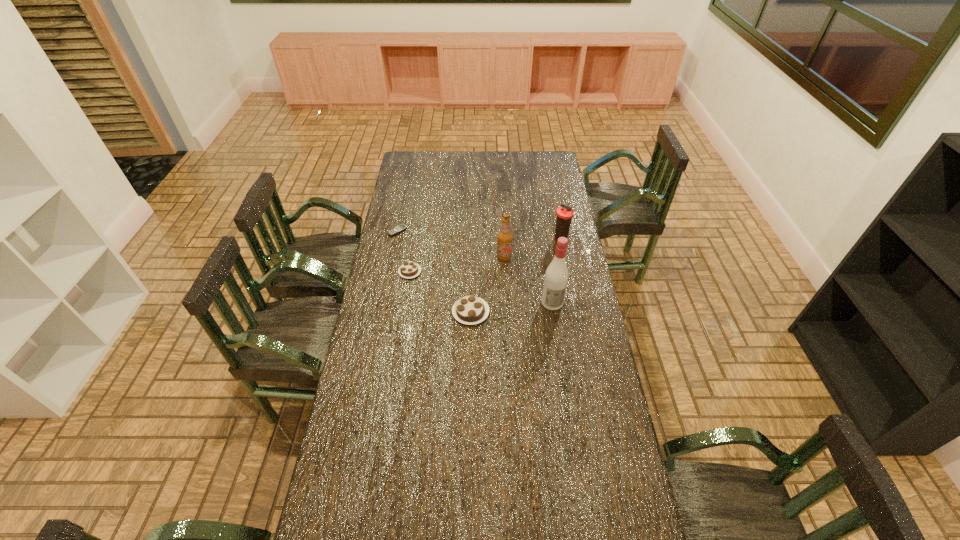
Find the location of `the fifth object from left to right`. the fifth object from left to right is located at coordinates (556, 276).

Find the location of a particular element. vacant position located 0.100m on the right of the farther chocolate cake is located at coordinates (444, 272).

Identify the location of vacant space located on the right of the fourth object from right to left. The width and height of the screenshot is (960, 540). (518, 312).

Find the location of a particular element. Image resolution: width=960 pixels, height=540 pixels. vacant space located on the left of the thermos bottle is located at coordinates (540, 239).

The image size is (960, 540). I want to click on vacant space located on the front label of the fourth nearest object, so click(x=509, y=335).

At what (x,y) coordinates should I click in order to perform the action: click on free space located 0.200m on the front of the shortest object. Please return your answer as a coordinate pair (x, y). Looking at the image, I should click on (391, 266).

Find the location of a particular element. This screenshot has width=960, height=540. vacant space located 0.260m on the label of the alcohol is located at coordinates (562, 366).

You are a GUI agent. You are given a task and a screenshot of the screen. Output one action in this format:
    pyautogui.click(x=<x>, y=<y>)
    Task: Click on the chocolate cake that is at the left edge
    The image size is (960, 540).
    Given the screenshot: What is the action you would take?
    pyautogui.click(x=409, y=269)

Where is `beeper located in the left edge section of the desktop`? beeper located in the left edge section of the desktop is located at coordinates (402, 227).

You are a GUI agent. You are given a task and a screenshot of the screen. Output one action in this format:
    pyautogui.click(x=<x>, y=<y>)
    Task: Click on the thermos bottle located in the right edge section of the desktop
    The width and height of the screenshot is (960, 540).
    Given the screenshot: What is the action you would take?
    pyautogui.click(x=564, y=213)